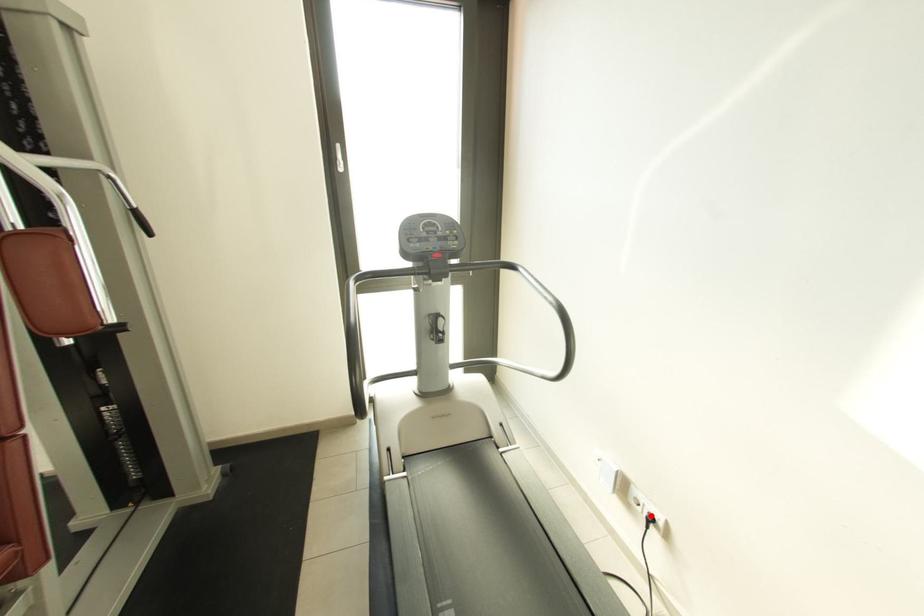
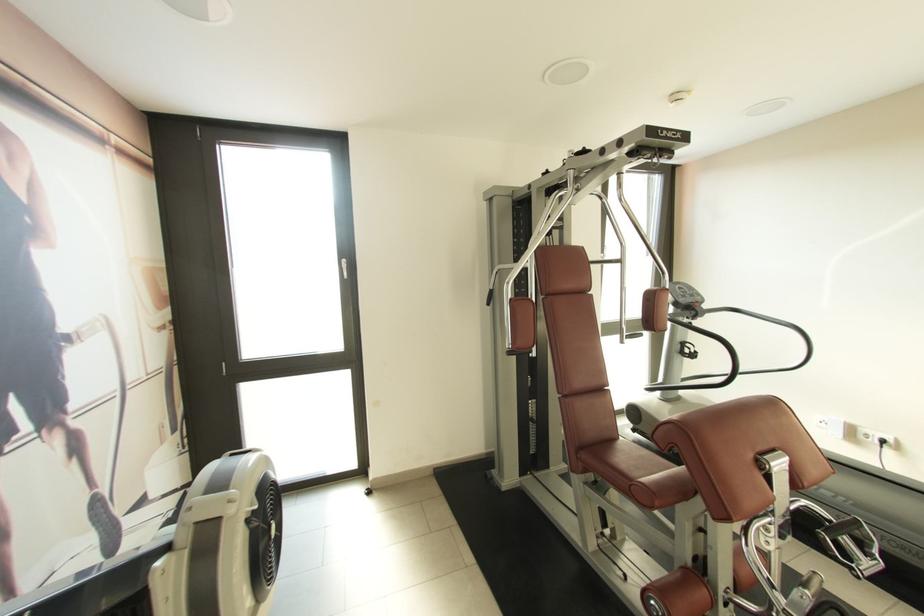
Where in the second image is the point corresponding to the highlighted location from the first image?

(882, 440)